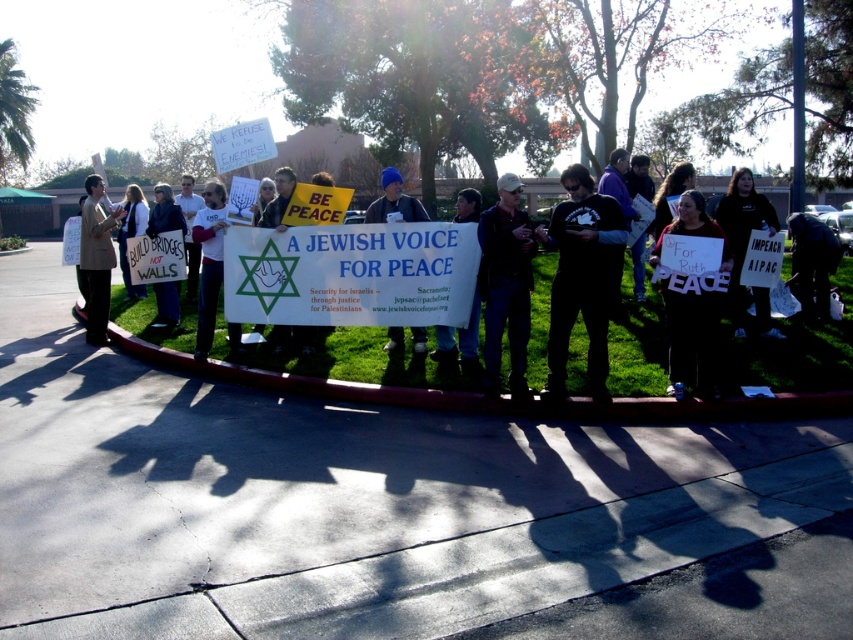
Question: Is black cotton shirt at center to the right of dark blue jeans at center from the viewer's perspective?

Choices:
 (A) yes
 (B) no

Answer: (A)

Question: Considering the relative positions of black fabric sign at right and matte brown suit at left in the image provided, where is black fabric sign at right located with respect to matte brown suit at left?

Choices:
 (A) below
 (B) above

Answer: (A)

Question: Among these points, which one is farthest from the camera?

Choices:
 (A) (102, 289)
 (B) (523, 369)
 (C) (683, 225)
 (D) (184, 340)

Answer: (A)

Question: Among these objects, which one is nearest to the camera?

Choices:
 (A) matte black jacket at center
 (B) matte black sign at center
 (C) white paper sign at center

Answer: (B)

Question: Does black cotton shirt at center appear under dark blue jeans at center?

Choices:
 (A) yes
 (B) no

Answer: (B)

Question: Which of the following is the farthest from the observer?

Choices:
 (A) dark blue jeans at center
 (B) black t-shirt at center

Answer: (A)